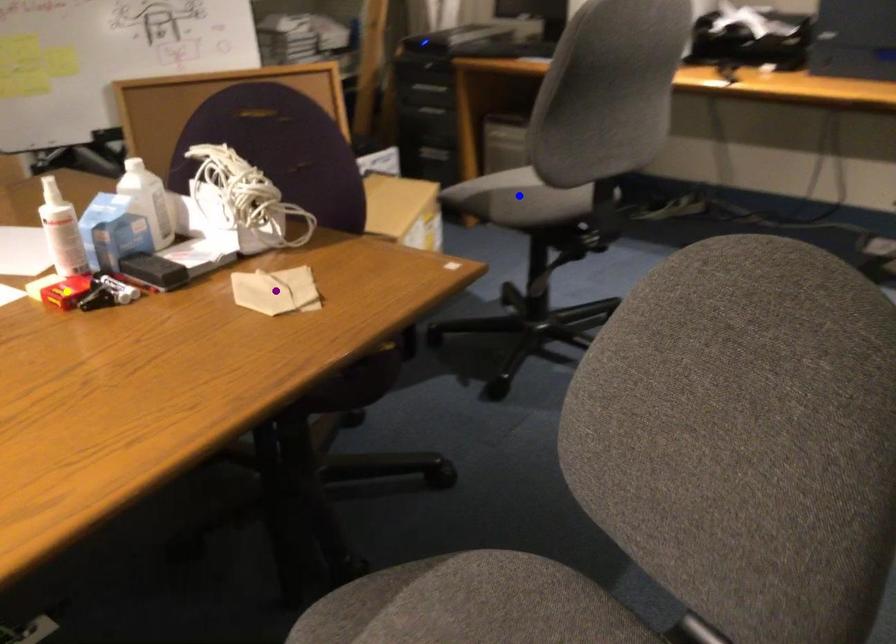
Order these from nearest to farthest:
blue point, yellow point, purple point

yellow point, purple point, blue point